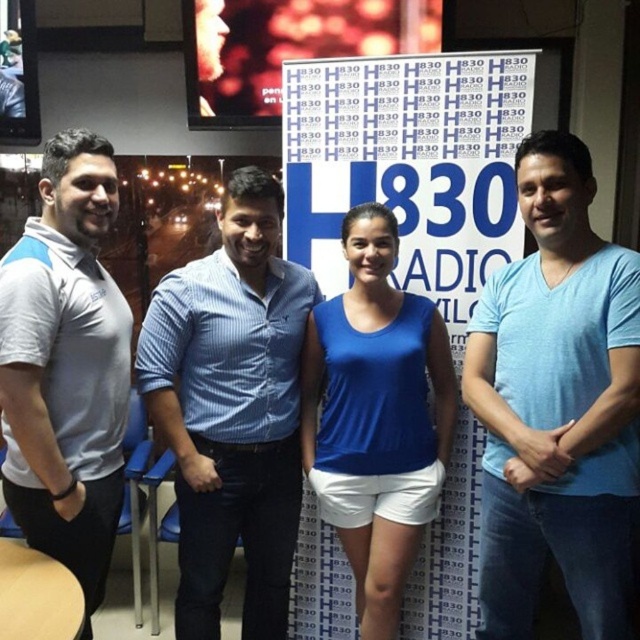
Question: Is blue striped shirt at center smaller than gray fabric polo shirt at left?

Choices:
 (A) no
 (B) yes

Answer: (A)

Question: Can you confirm if blue striped shirt at center is positioned below gray fabric polo shirt at left?

Choices:
 (A) no
 (B) yes

Answer: (B)

Question: Among these points, which one is nearest to the camera?

Choices:
 (A) (364, 316)
 (B) (368, 145)

Answer: (A)

Question: Is light blue cotton shirt at right smaller than blue striped shirt at center?

Choices:
 (A) yes
 (B) no

Answer: (B)

Question: Which point is closer to the camera?

Choices:
 (A) (348, 202)
 (B) (337, 340)
 (C) (536, 208)
 (D) (186, 392)

Answer: (C)

Question: Among these points, which one is farthest from the camera?

Choices:
 (A) (232, 364)
 (B) (593, 497)

Answer: (A)